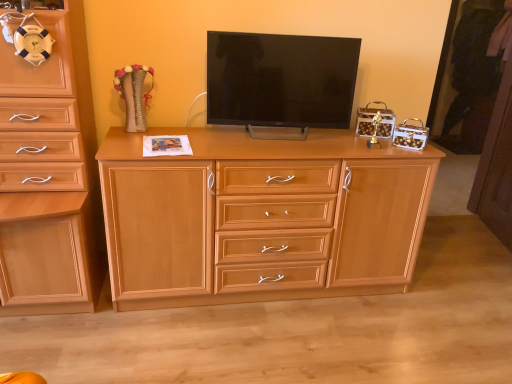
Where is `free spot in front of matte black tv at center`? This screenshot has height=384, width=512. free spot in front of matte black tv at center is located at coordinates (269, 146).